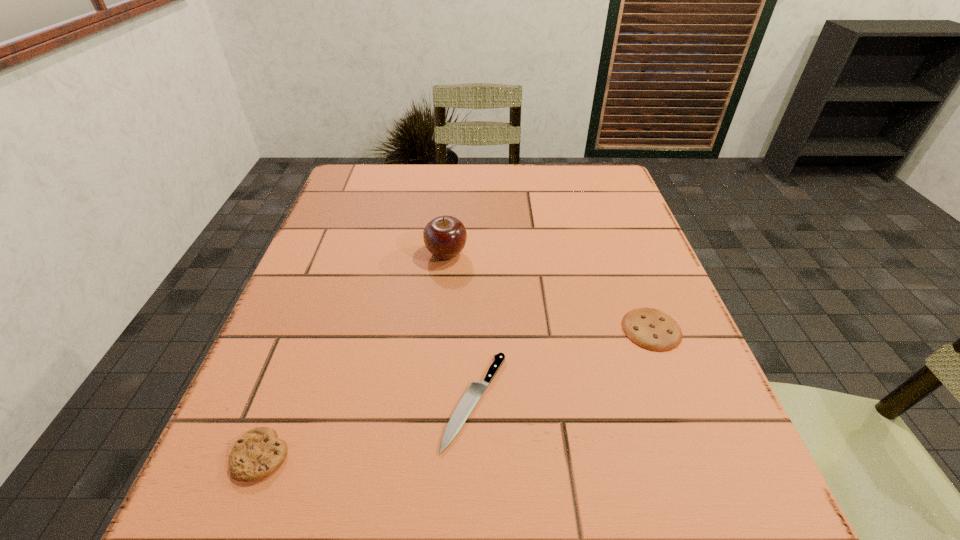
At what (x,y) coordinates should I click in order to perform the action: click on the farthest object. Please return your answer as a coordinate pair (x, y). The image size is (960, 540). Looking at the image, I should click on (445, 236).

Locate an element on the screen. apple is located at coordinates (445, 236).

Where is `the nearer cookie`? The image size is (960, 540). the nearer cookie is located at coordinates coord(258,453).

Locate an element on the screen. the left cookie is located at coordinates (258, 453).

Image resolution: width=960 pixels, height=540 pixels. What are the coordinates of `the third tallest object` in the screenshot? It's located at (652, 329).

Find the location of a particular element. Image resolution: width=960 pixels, height=540 pixels. the shorter cookie is located at coordinates (652, 329).

Where is `steak knife`? steak knife is located at coordinates (469, 400).

The width and height of the screenshot is (960, 540). In order to click on blank space located 0.390m on the front of the tallest object in this screenshot , I will do `click(430, 438)`.

In order to click on free point located on the back of the left cookie in this screenshot , I will do `click(310, 327)`.

Locate an element on the screen. The image size is (960, 540). blank space located 0.130m on the front of the right cookie is located at coordinates (685, 418).